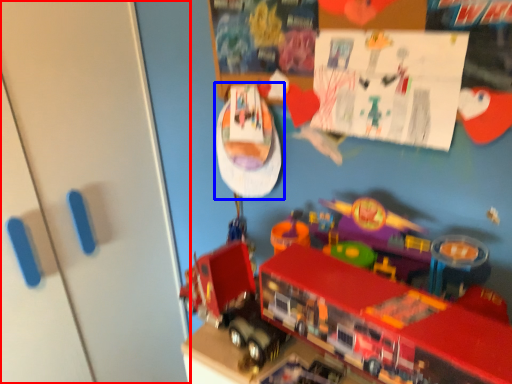
Question: Which point is closer to the camera, door (highlighted by a red box) or toy (highlighted by a blue box)?

Choices:
 (A) door
 (B) toy

Answer: (A)